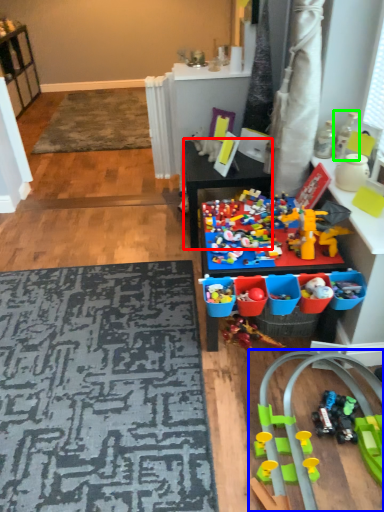
Question: Estimate the real-world distances between objects in this image. Which object is closer to table (highlighted by a red box), toy (highlighted by a blue box) or toy (highlighted by a green box)?

Choices:
 (A) toy
 (B) toy

Answer: (B)